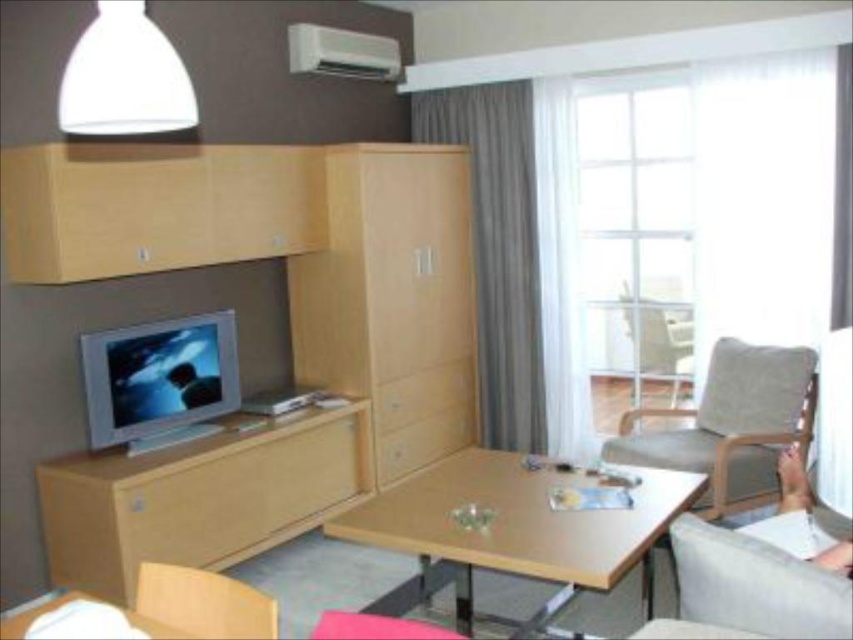
You are a hotel guest who wants to place a 30 inch wide decorative shelf between the light brown fabric armchair at right and the light gray fabric armchair at center. Is there enough space to fit it?

The distance between the light brown fabric armchair at right and the light gray fabric armchair at center is 34.03 inches, which is wider than the 30 inch shelf. Therefore, there is enough space to place the shelf between them.